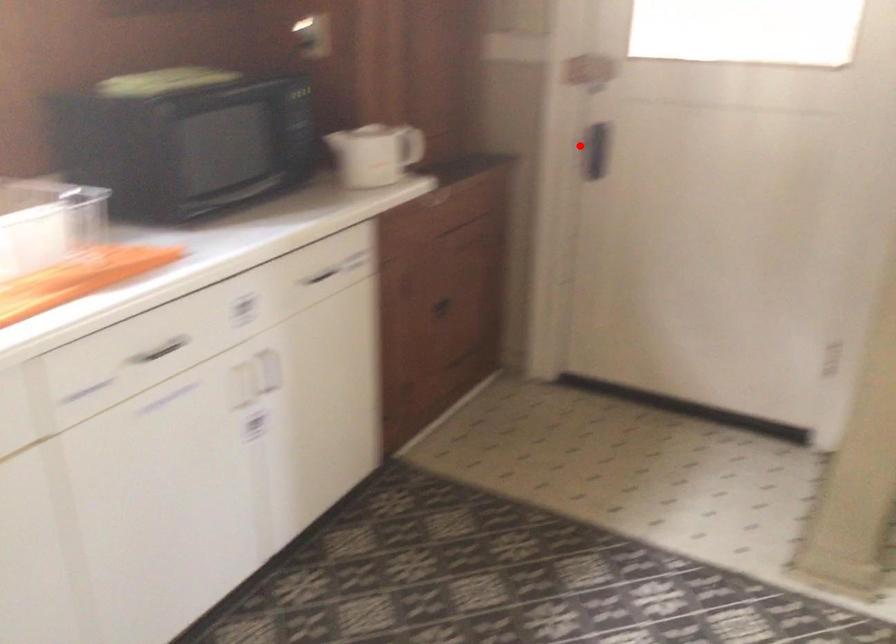
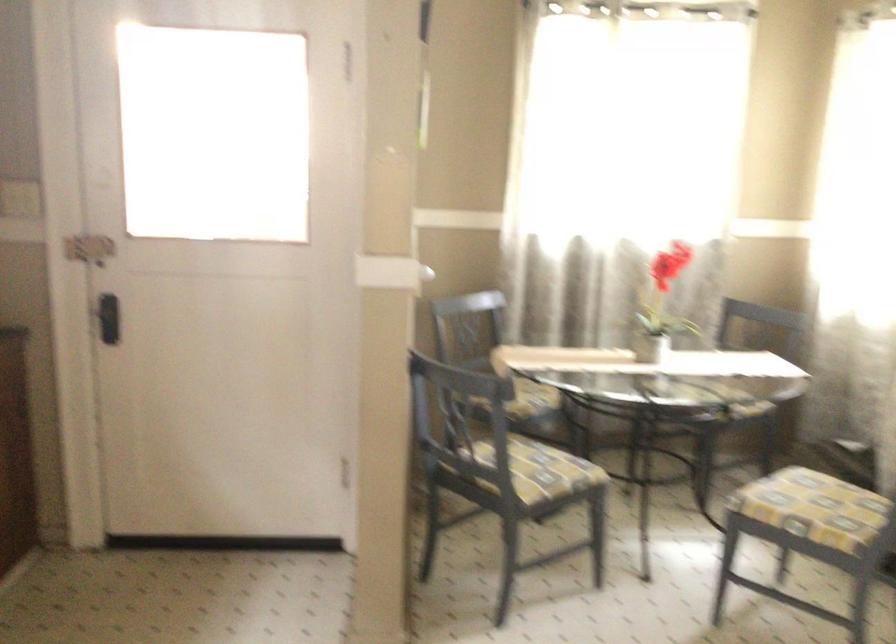
Find the pixel in the second image that matches the highlighted location in the first image.

(108, 317)